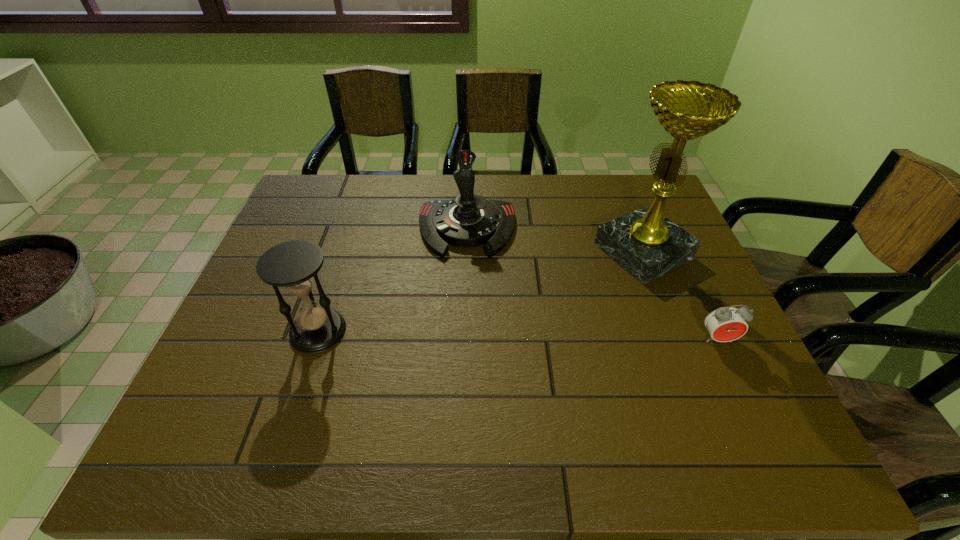
You are a GUI agent. You are given a task and a screenshot of the screen. Output one action in this format:
    pyautogui.click(x=<x>, y=<y>)
    Task: Click on the vacant region located 0.280m on the front-facing side of the award
    The image size is (960, 540).
    Given the screenshot: What is the action you would take?
    pyautogui.click(x=524, y=308)

Where is `vacant area located on the front-facing side of the award`? This screenshot has width=960, height=540. vacant area located on the front-facing side of the award is located at coordinates (591, 275).

Find the location of a particular element. This screenshot has width=960, height=540. object at the far edge is located at coordinates (469, 220).

The height and width of the screenshot is (540, 960). What are the coordinates of `object located in the left edge section of the desktop` in the screenshot? It's located at (293, 265).

You are a GUI agent. You are given a task and a screenshot of the screen. Output one action in this format:
    pyautogui.click(x=<x>, y=<y>)
    Task: Click on the alarm clock at the right edge
    This screenshot has height=540, width=960.
    Given the screenshot: What is the action you would take?
    pyautogui.click(x=725, y=324)

Image resolution: width=960 pixels, height=540 pixels. What are the coordinates of `award that is at the right edge` in the screenshot? It's located at tap(644, 242).

In the image, there is a desktop. Identify the location of vacant space at the far edge. (394, 212).

In the image, there is a desktop. Identify the location of vacant space at the near edge. (562, 407).

Locate an element on the screen. free point at the left edge is located at coordinates (285, 227).

Image resolution: width=960 pixels, height=540 pixels. In the image, there is a desktop. What are the coordinates of `vacant space at the near right corner` in the screenshot? It's located at (735, 397).